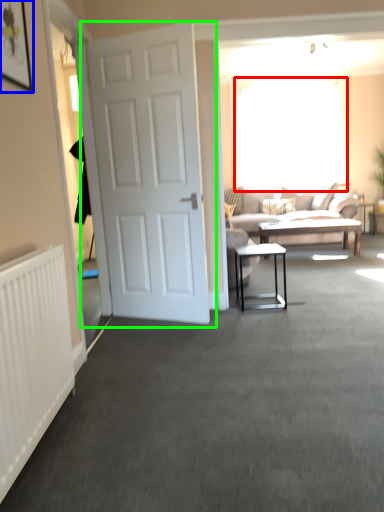
Question: Estimate the real-world distances between objects in this image. Which object is closer to window screen (highlighted by a red box), picture frame (highlighted by a blue box) or door (highlighted by a green box)?

Choices:
 (A) picture frame
 (B) door

Answer: (B)